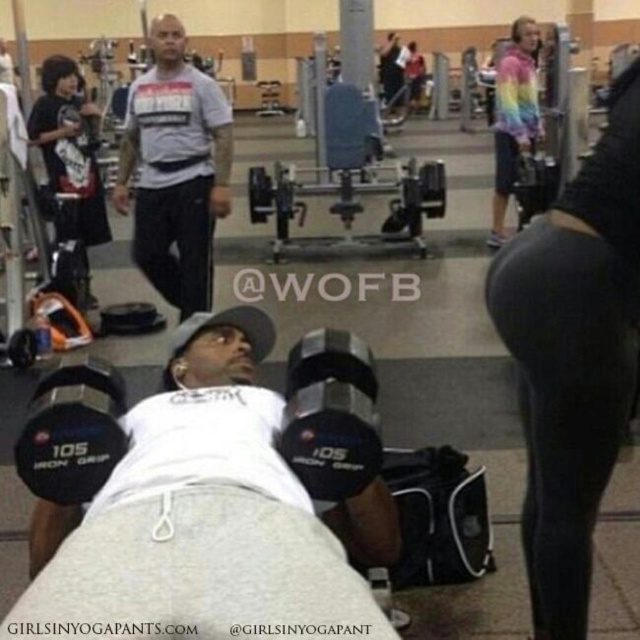
Question: Is white t-shirt at center positioned at the back of rainbow tie-dye hoodie at upper right?

Choices:
 (A) no
 (B) yes

Answer: (A)

Question: Which of these objects is positioned farthest from the white t-shirt at center?

Choices:
 (A) black iron grip dumbbells at center
 (B) rainbow tie-dye hoodie at upper right

Answer: (B)

Question: Does white t-shirt at center have a smaller size compared to rainbow tie-dye hoodie at upper right?

Choices:
 (A) no
 (B) yes

Answer: (B)

Question: Among these points, which one is farthest from the camera?

Choices:
 (A) [x=531, y=106]
 (B) [x=308, y=406]
 (C) [x=154, y=275]

Answer: (A)

Question: Is the position of white t-shirt at center more distant than that of rainbow tie-dye hoodie at upper right?

Choices:
 (A) yes
 (B) no

Answer: (B)

Question: Based on their relative distances, which object is farther from the black iron grip dumbbells at center?

Choices:
 (A) white t-shirt at center
 (B) rainbow tie-dye hoodie at upper right

Answer: (B)